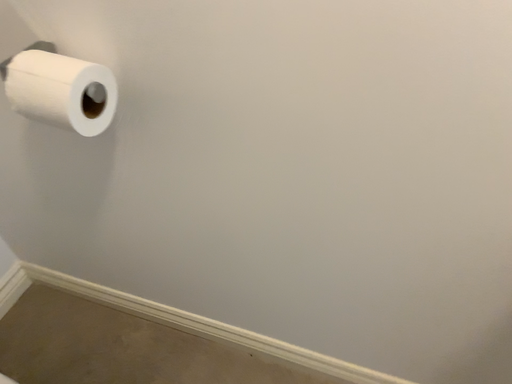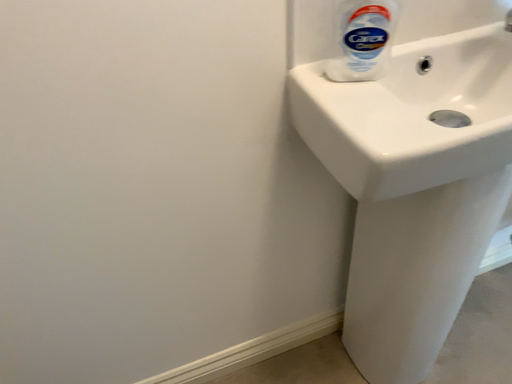
Question: Which way did the camera rotate in the video?

Choices:
 (A) rotated left
 (B) rotated right

Answer: (B)